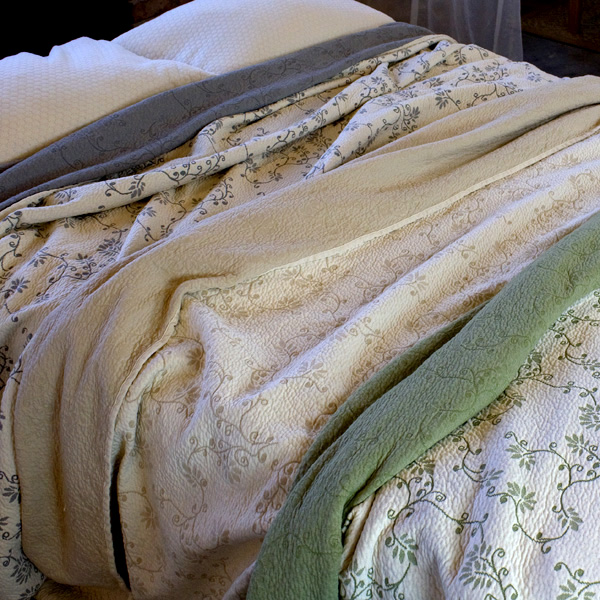
You are a GUI agent. You are given a task and a screenshot of the screen. Output one action in this format:
    pyautogui.click(x=<x>, y=<y>)
    Task: Click on the pillow case
    This screenshot has width=600, height=600.
    Given the screenshot: What is the action you would take?
    point(73,76), point(260,41)